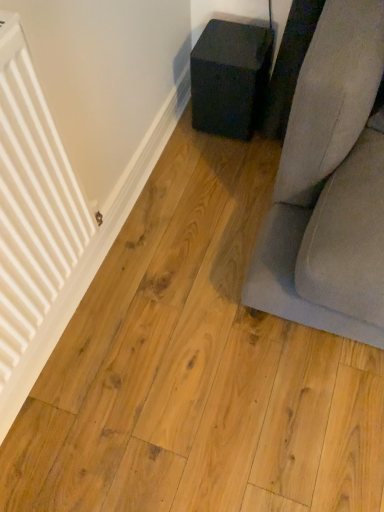
What are the coordinates of `free spot in front of matte black cube at center` in the screenshot? It's located at (219, 161).